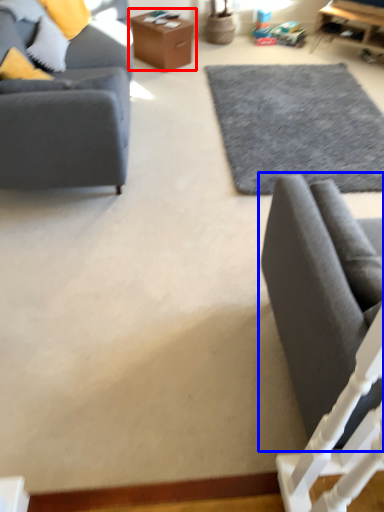
Question: Which object appears closest to the camera in this image, table (highlighted by a red box) or studio couch (highlighted by a blue box)?

Choices:
 (A) table
 (B) studio couch

Answer: (B)